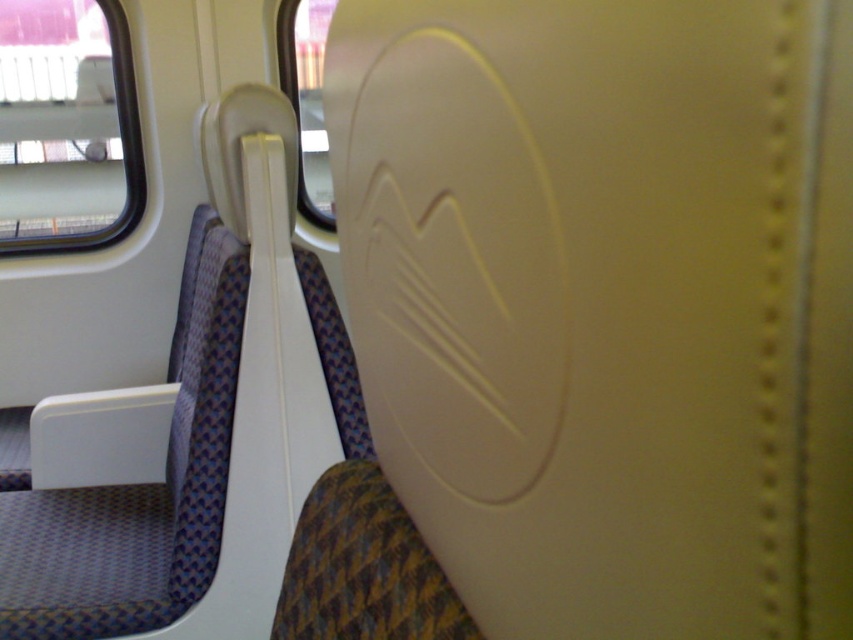
You are standing in the train seat area and want to reach the point at coordinates point (3,84). If your arm can reach up to 2 meters, can you reach it?

The distance of point (3,84) from camera is 3.36 meters, so no, your arm cannot reach it since it is farther than 2 meters.

You are a passenger sitting in the seat and looking at the transparent glass window at upper left and the transparent glass window at upper center. Which window is taller?

The transparent glass window at upper left is taller than the transparent glass window at upper center.